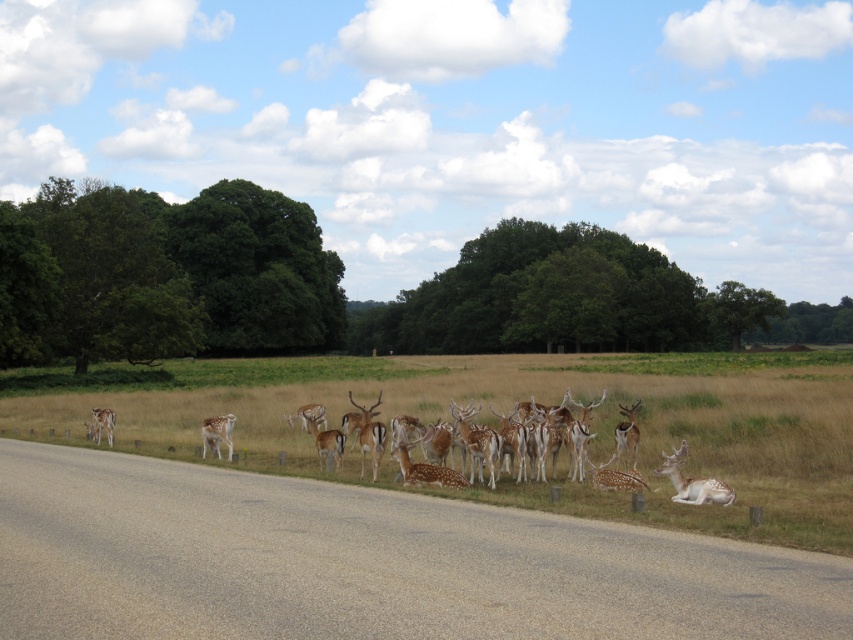
Question: Which point appears farthest from the camera in this image?

Choices:
 (A) (102, 410)
 (B) (616, 429)
 (C) (213, 426)
 (D) (682, 480)

Answer: (A)

Question: Can you confirm if fawn-patterned antlers at center is positioned below fawn fur at road?

Choices:
 (A) no
 (B) yes

Answer: (A)

Question: Does fawn fur at center appear on the right side of brown speckled fur at road left?

Choices:
 (A) yes
 (B) no

Answer: (A)

Question: Which object appears farthest from the camera in this image?

Choices:
 (A) fawn-patterned antlers at center
 (B) brown speckled fur at road left
 (C) spotted fur deer at lower right

Answer: (B)

Question: Which point is closer to the camera?

Choices:
 (A) (637, 484)
 (B) (228, 436)
 (C) (94, 410)
 (D) (712, 493)

Answer: (D)

Question: From the image, what is the correct spatial relationship of spotted fur deer at lower right in relation to fawn fur at road?

Choices:
 (A) above
 (B) below

Answer: (A)